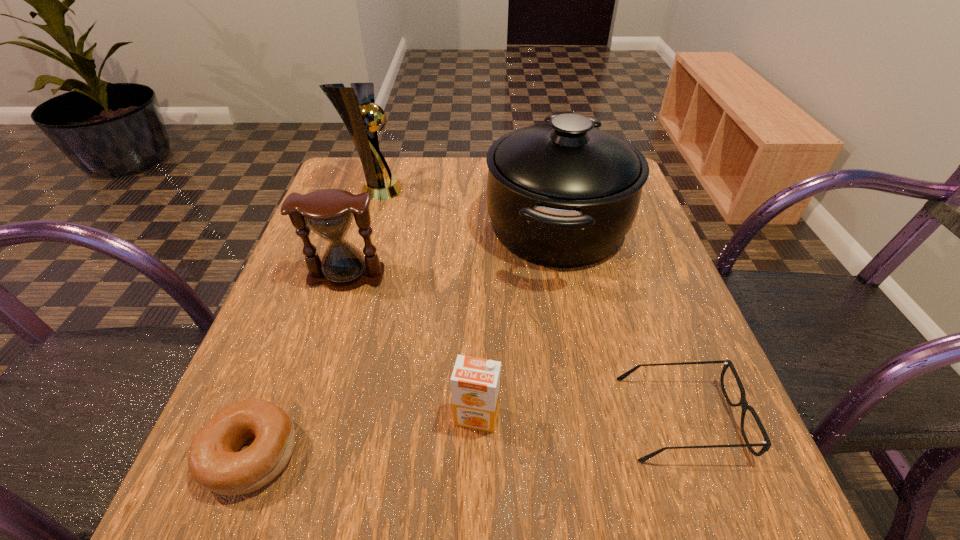
Where is `free space at the right edge of the desktop`? free space at the right edge of the desktop is located at coordinates [x=675, y=280].

This screenshot has height=540, width=960. In order to click on vacant space at the far left corner of the desktop in this screenshot , I will do `click(362, 173)`.

In the image, there is a desktop. At what (x,y) coordinates should I click in order to perform the action: click on vacant space at the near left corner. Please return your answer as a coordinate pair (x, y). The image size is (960, 540). Looking at the image, I should click on (185, 509).

The width and height of the screenshot is (960, 540). In order to click on vacant space at the near right corner of the desktop in this screenshot , I will do pyautogui.click(x=732, y=479).

Locate an element on the screen. This screenshot has width=960, height=540. vacant area between the bagel and the award is located at coordinates (313, 322).

Find the location of a particular element. This screenshot has height=540, width=960. unoccupied area between the fifth shortest object and the hourglass is located at coordinates (x=452, y=251).

Find the location of a particular element. This screenshot has height=540, width=960. empty space between the fifth shortest object and the spectacles is located at coordinates (619, 322).

At what (x,y) coordinates should I click in order to perform the action: click on vacant space in between the second tallest object and the orange juice. Please return your answer as a coordinate pair (x, y). The width and height of the screenshot is (960, 540). Looking at the image, I should click on (516, 321).

Locate an element on the screen. This screenshot has height=540, width=960. free spot between the saucepan and the bagel is located at coordinates (404, 340).

The image size is (960, 540). Find the location of `vacant space that is in between the saucepan and the third shortest object`. vacant space that is in between the saucepan and the third shortest object is located at coordinates (516, 321).